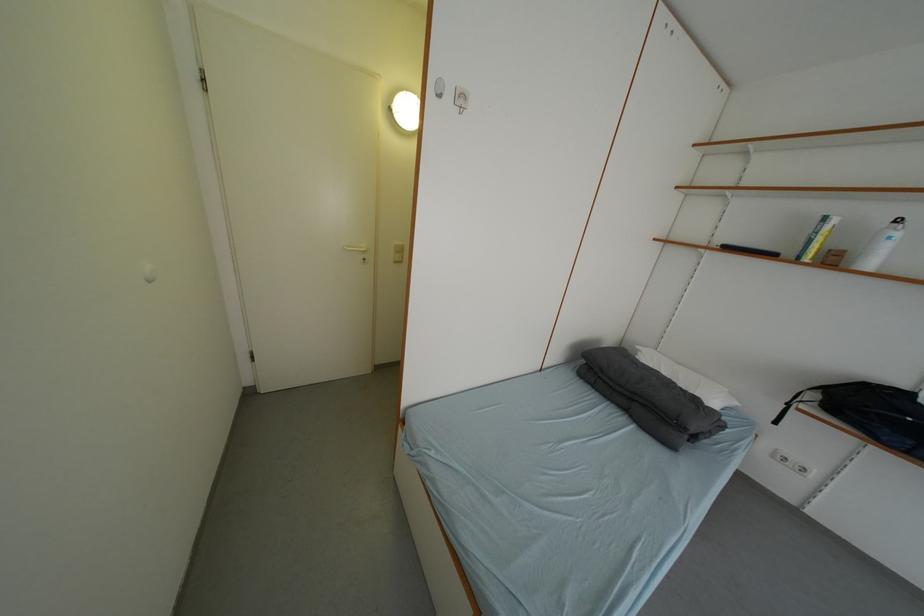
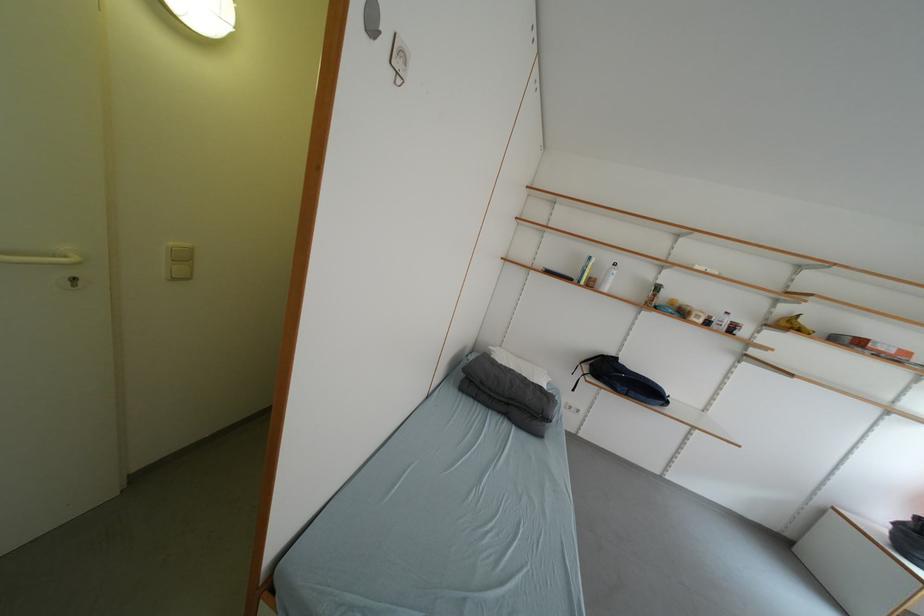
In the second image, find the point that corresponds to (x=469, y=103) in the first image.

(407, 62)